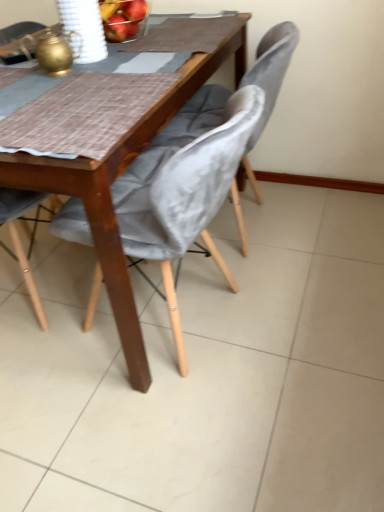
Question: Can you confirm if velvet grey chair at center, the third chair from the left, is thinner than velvet grey chair at lower left, which is the 1th chair from left to right?

Choices:
 (A) no
 (B) yes

Answer: (B)

Question: Would you consider velvet grey chair at center, the third chair from the left, to be distant from velvet grey chair at lower left, the 3th chair positioned from the right?

Choices:
 (A) no
 (B) yes

Answer: (B)

Question: Is velvet grey chair at center, the 1th chair in the right-to-left sequence, facing towards velvet grey chair at lower left, the 3th chair positioned from the right?

Choices:
 (A) yes
 (B) no

Answer: (B)

Question: Does velvet grey chair at center, the third chair from the left, have a lesser height compared to velvet grey chair at lower left, which is the 1th chair from left to right?

Choices:
 (A) yes
 (B) no

Answer: (A)

Question: Does velvet grey chair at center, the 1th chair in the right-to-left sequence, lie behind velvet grey chair at lower left, which is the 1th chair from left to right?

Choices:
 (A) yes
 (B) no

Answer: (A)

Question: Choose the correct answer: Is velvet grey chair at lower left, which is the 1th chair from left to right, inside velvet grey chair at center, the second chair positioned from the left, or outside it?

Choices:
 (A) outside
 (B) inside

Answer: (A)

Question: In terms of width, does velvet grey chair at lower left, which is the 1th chair from left to right, look wider or thinner when compared to velvet grey chair at center, the second chair positioned from the left?

Choices:
 (A) thin
 (B) wide

Answer: (A)

Question: In terms of height, does velvet grey chair at lower left, the 3th chair positioned from the right, look taller or shorter compared to velvet grey chair at center, the second chair positioned from the left?

Choices:
 (A) tall
 (B) short

Answer: (A)

Question: In terms of size, does velvet grey chair at lower left, the 3th chair positioned from the right, appear bigger or smaller than velvet grey chair at center, which is the second chair in right-to-left order?

Choices:
 (A) big
 (B) small

Answer: (A)

Question: Looking at the image, does velvet grey chair at center, the third chair from the left, seem bigger or smaller compared to velvet grey chair at center, which is the second chair in right-to-left order?

Choices:
 (A) small
 (B) big

Answer: (A)

Question: From the image's perspective, relative to velvet grey chair at center, which is the second chair in right-to-left order, is velvet grey chair at center, the third chair from the left, above or below?

Choices:
 (A) below
 (B) above

Answer: (B)

Question: Is point (261, 201) positioned closer to the camera than point (226, 184)?

Choices:
 (A) farther
 (B) closer

Answer: (A)

Question: Looking at their shapes, would you say velvet grey chair at center, the third chair from the left, is wider or thinner than velvet grey chair at center, which is the second chair in right-to-left order?

Choices:
 (A) thin
 (B) wide

Answer: (A)

Question: From the image's perspective, relative to velvet grey chair at lower left, the 3th chair positioned from the right, is velvet grey chair at center, the third chair from the left, above or below?

Choices:
 (A) below
 (B) above

Answer: (B)

Question: In the image, is velvet grey chair at center, the third chair from the left, positioned in front of or behind velvet grey chair at lower left, the 3th chair positioned from the right?

Choices:
 (A) front
 (B) behind

Answer: (B)